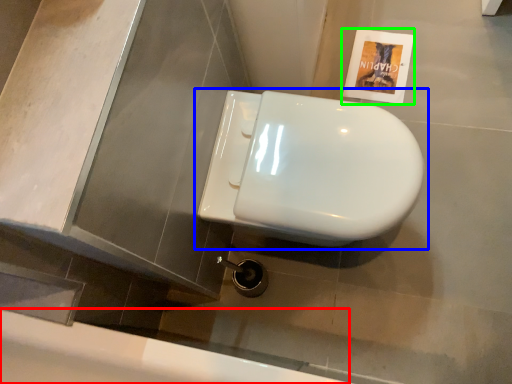
Question: Which object is positioned closest to bath (highlighted by a red box)? Select from toilet (highlighted by a blue box) and flyer (highlighted by a green box).

Choices:
 (A) toilet
 (B) flyer

Answer: (A)